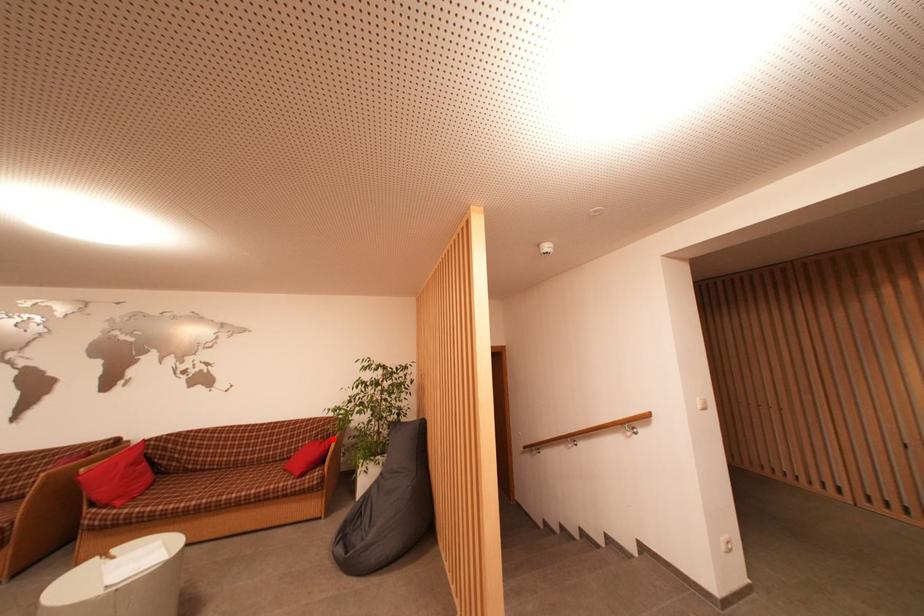
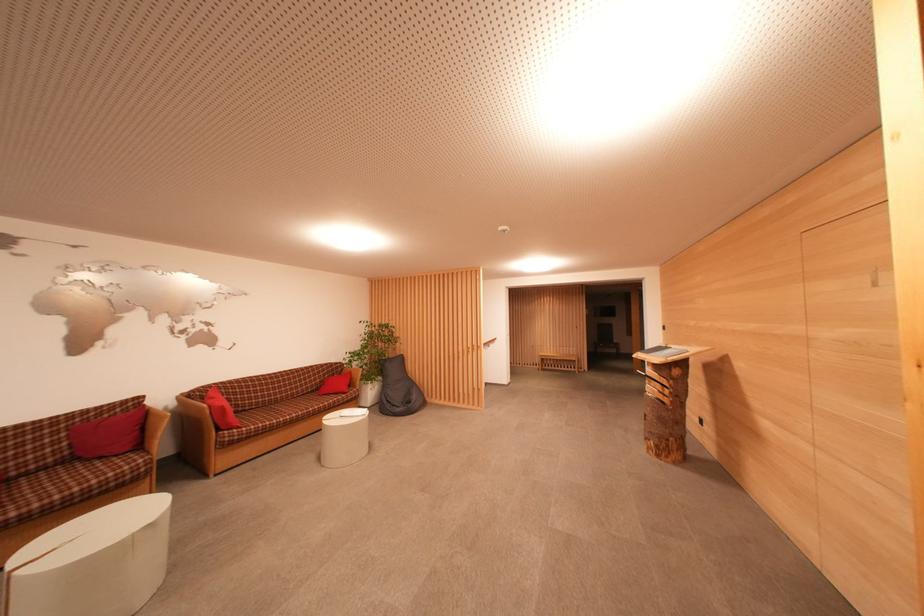
In the second image, find the point that corresponds to the highlighted location in the first image.

(337, 378)